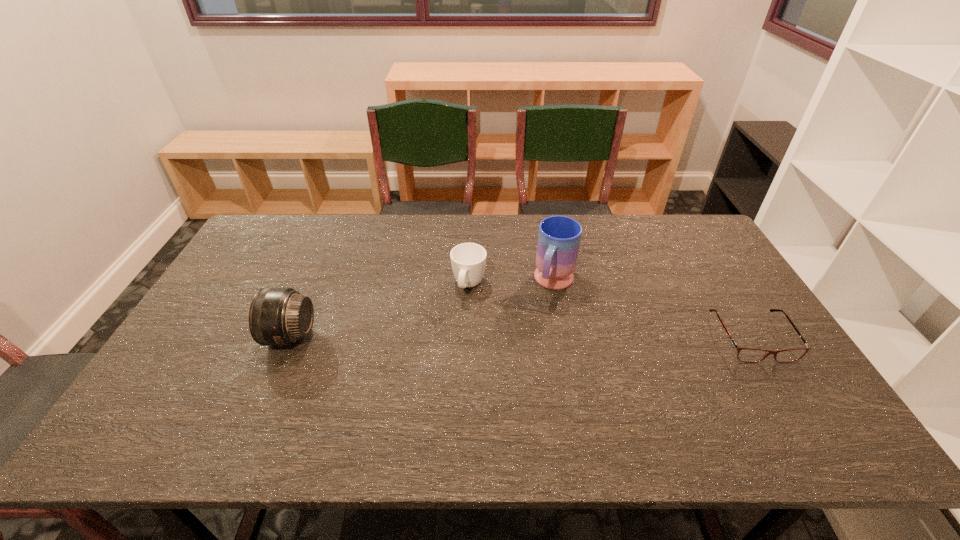
Locate an element on the screen. blank space located 0.080m on the lenses of the rightmost object is located at coordinates (783, 389).

At what (x,y) coordinates should I click in order to perform the action: click on vacant space situated on the side of the tallest object with the handle. Please return your answer as a coordinate pair (x, y). This screenshot has width=960, height=540. Looking at the image, I should click on (542, 316).

The image size is (960, 540). What are the coordinates of `vacant point located 0.320m on the side of the tallest object with the handle` in the screenshot? It's located at (513, 383).

The height and width of the screenshot is (540, 960). Identify the location of free spot located on the side of the tallest object with the handle. (505, 399).

This screenshot has height=540, width=960. I want to click on vacant space located with the handle on the side of the second object from left to right, so click(x=445, y=363).

The image size is (960, 540). In order to click on vacant space situated with the handle on the side of the second object from left to right in this screenshot , I will do `click(454, 335)`.

Where is `free space located 0.290m with the handle on the side of the second object from left to right`? free space located 0.290m with the handle on the side of the second object from left to right is located at coordinates (439, 382).

Where is `object located at the right edge`? The image size is (960, 540). object located at the right edge is located at coordinates (751, 355).

At what (x,y) coordinates should I click in order to perform the action: click on free spot at the far edge of the desktop. Please return your answer as a coordinate pair (x, y). Image resolution: width=960 pixels, height=540 pixels. Looking at the image, I should click on (517, 215).

At what (x,y) coordinates should I click in order to perform the action: click on free space at the near edge of the desktop. Please return your answer as a coordinate pair (x, y). Looking at the image, I should click on pos(222,384).